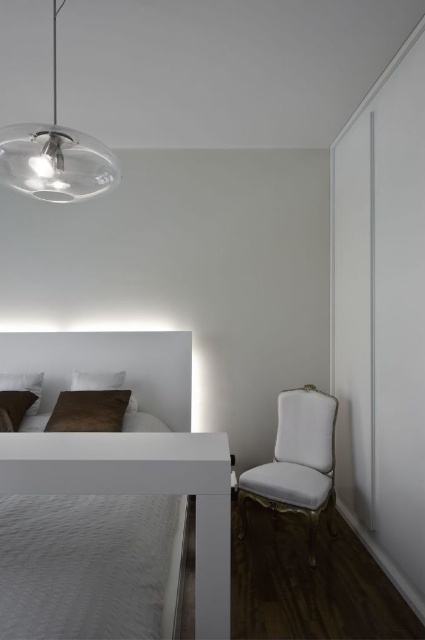
Question: Which of these objects is positioned farthest from the transparent glass pendant light at upper left?

Choices:
 (A) brown suede pillow at lower left
 (B) white soft pillow at lower left

Answer: (B)

Question: Which point is closer to the camera taking this photo?

Choices:
 (A) (56, 179)
 (B) (328, 468)
 (C) (110, 404)

Answer: (A)

Question: Among these objects, which one is farthest from the camera?

Choices:
 (A) white fabric armchair at right
 (B) white glossy bed at center
 (C) brown suede pillow at lower left

Answer: (B)

Question: Is brown matte headboard at center above brown suede pillow at lower left?

Choices:
 (A) no
 (B) yes

Answer: (B)

Question: Can you confirm if transparent glass pendant light at upper left is smaller than velvet brown pillow at lower left?

Choices:
 (A) no
 (B) yes

Answer: (A)

Question: Can you confirm if white fabric armchair at right is positioned above white soft pillow at upper left?

Choices:
 (A) no
 (B) yes

Answer: (A)